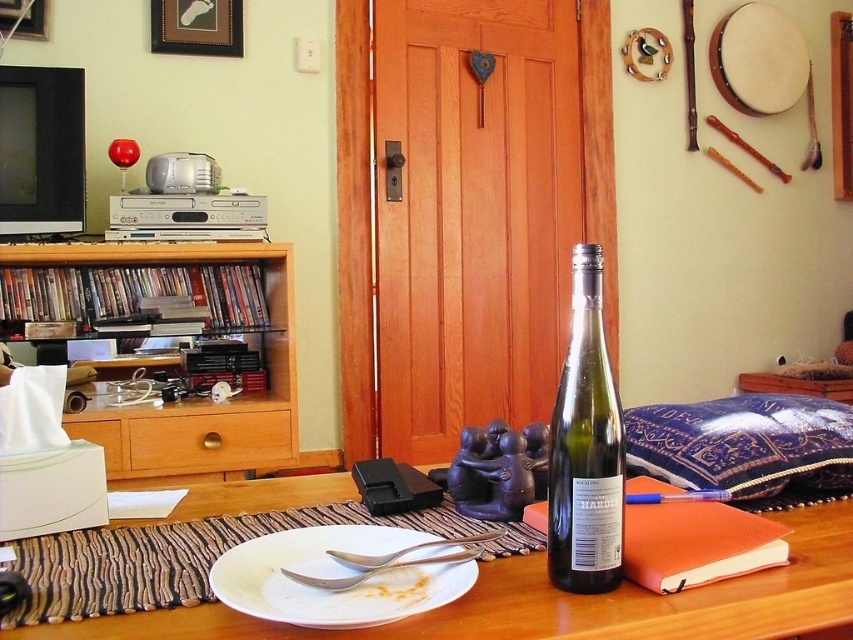
Question: Is woodenmaterial/texturedvd cabinet at left to the left of silver metallic spoon at lower center from the viewer's perspective?

Choices:
 (A) no
 (B) yes

Answer: (B)

Question: Is wooden drawer at center positioned before wooden picture frame at upper left?

Choices:
 (A) no
 (B) yes

Answer: (B)

Question: Which point is closer to the camera taking this photo?

Choices:
 (A) (293, 451)
 (B) (15, 12)

Answer: (A)

Question: Which object is the farthest from the brushed metal picture frame at upper left?

Choices:
 (A) wooden drawer at lower left
 (B) silver metallic spoon at lower center
 (C) woodenmaterial/texturedvd cabinet at left

Answer: (B)

Question: Which point is closer to the camera?

Choices:
 (A) (480, 541)
 (B) (102, 376)
 (C) (177, 17)
 (D) (112, 468)

Answer: (A)

Question: Does woodenmaterial/texturedvd cabinet at left appear on the left side of green glass bottle at center?

Choices:
 (A) yes
 (B) no

Answer: (A)